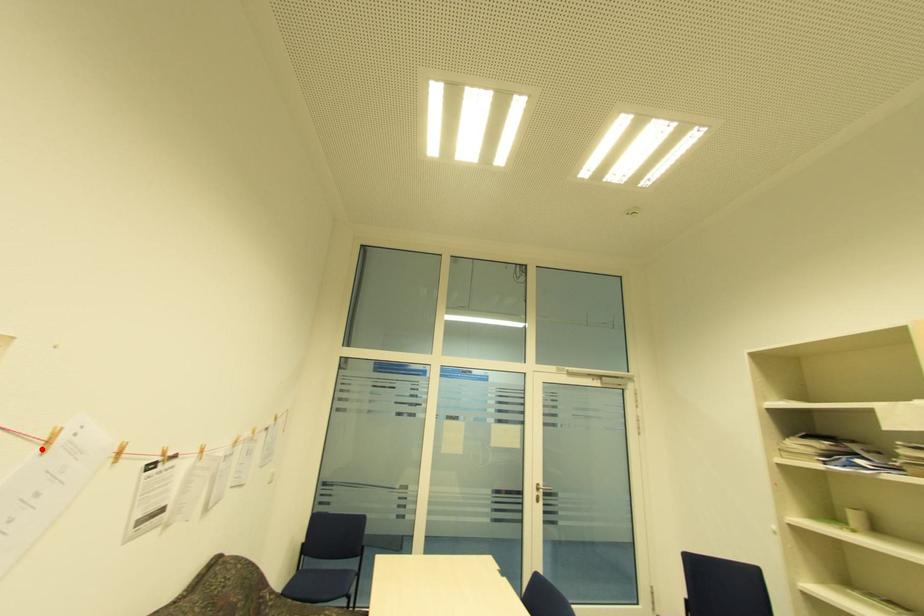
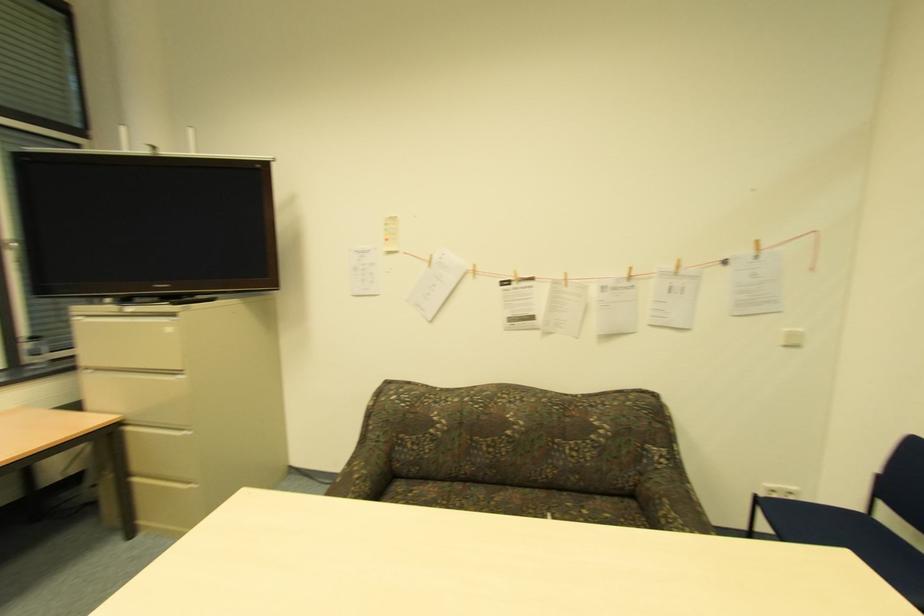
Find the pixel in the second image that matches the highlighted location in the first image.

(428, 265)